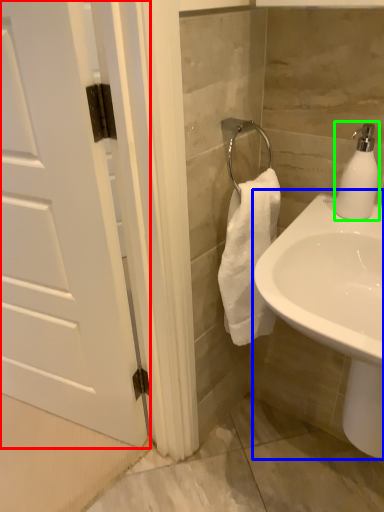
Question: Estimate the real-world distances between objects in this image. Which object is closer to door (highlighted by a red box), sink (highlighted by a blue box) or soap dispenser (highlighted by a green box)?

Choices:
 (A) sink
 (B) soap dispenser

Answer: (A)